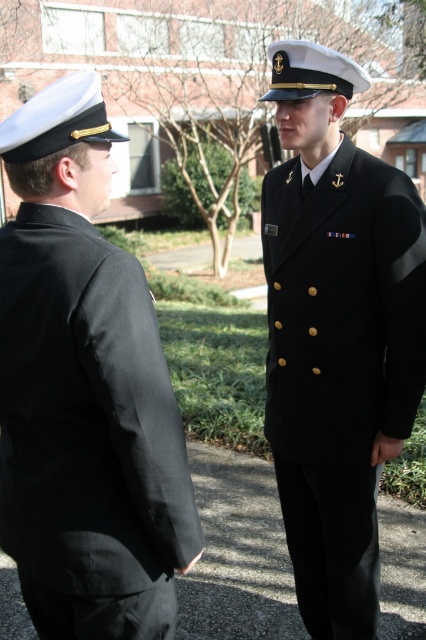
Please describe the position of the black smooth uniform at left in terms of coordinates within the image frame. The image frame has a coordinate system where the origin is at the bottom left corner, with x increasing to the right and y increasing upward.

The black smooth uniform at left is located at coordinates approximately 0.670 on the x axis and 0.202 on the y axis within the image frame.

You are a photographer trying to capture a group photo of the black smooth uniform at left and the black woolen jacket at center. Since you want to ensure both are fully visible, which object should you position closer to the camera to avoid being blocked by the other?

The black smooth uniform at left is shorter than the black woolen jacket at center, so positioning the black smooth uniform at left closer to the camera will prevent it from being blocked by the taller black woolen jacket at center.